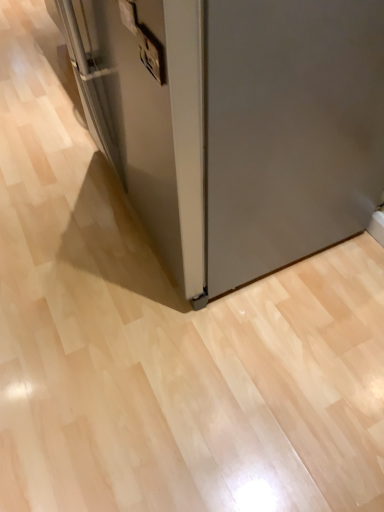
The image size is (384, 512). Describe the element at coordinates (235, 124) in the screenshot. I see `satin silver refrigerator at center` at that location.

Identify the location of satin silver refrigerator at center. (235, 124).

The height and width of the screenshot is (512, 384). In order to click on satin silver refrigerator at center in this screenshot , I will do `click(235, 124)`.